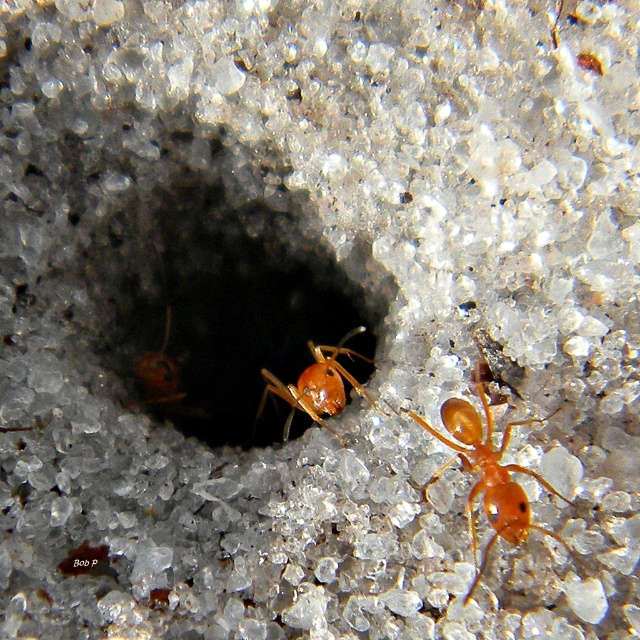
Question: Can you confirm if smooth sand hole at center is positioned below orange glossy ant at center?

Choices:
 (A) yes
 (B) no

Answer: (B)

Question: Is shiny orange ant at center wider than orange glossy ant at center?

Choices:
 (A) yes
 (B) no

Answer: (A)

Question: Which point is closer to the camera?

Choices:
 (A) orange glossy ant at center
 (B) orange matte ant at center

Answer: (B)

Question: Which point is farther to the camera?

Choices:
 (A) orange matte ant at center
 (B) shiny orange ant at center

Answer: (B)

Question: Which of the following is the closest to the observer?

Choices:
 (A) orange glossy ant at center
 (B) smooth sand hole at center
 (C) shiny orange ant at center
 (D) orange matte ant at center

Answer: (D)

Question: Is smooth sand hole at center wider than shiny orange ant at center?

Choices:
 (A) yes
 (B) no

Answer: (A)